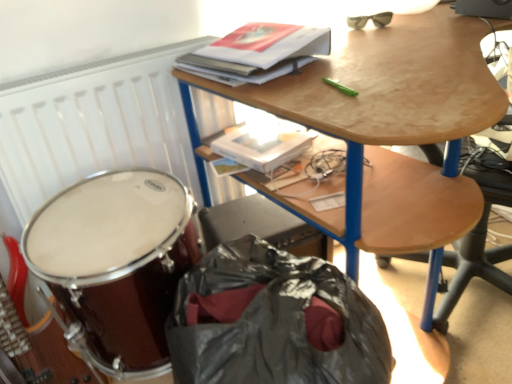
Find the location of a particular element. Image resolution: width=512 pixels, height=384 pixels. vacant space in front of matte black sunglasses at upper right is located at coordinates (391, 32).